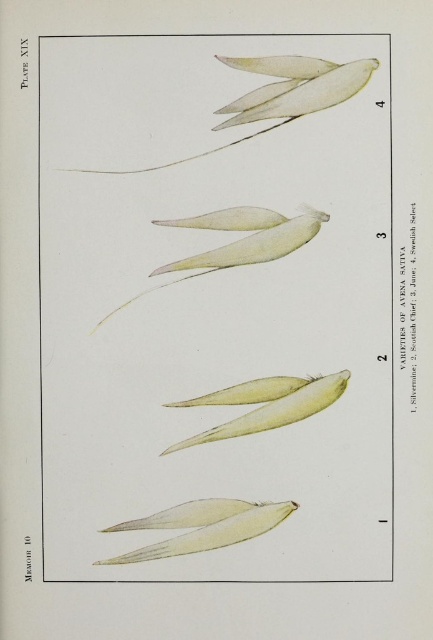
Is translucent paper-like leaf at lower center closer to the viewer compared to light yellow matte seed at center?

Yes, it is in front of light yellow matte seed at center.

Who is shorter, translucent paper-like leaf at lower center or light yellow matte seed at center?

translucent paper-like leaf at lower center is shorter.

Is point (106, 563) less distant than point (267, 400)?

Yes.

Where is `translucent paper-like leaf at lower center`? translucent paper-like leaf at lower center is located at coordinates (203, 525).